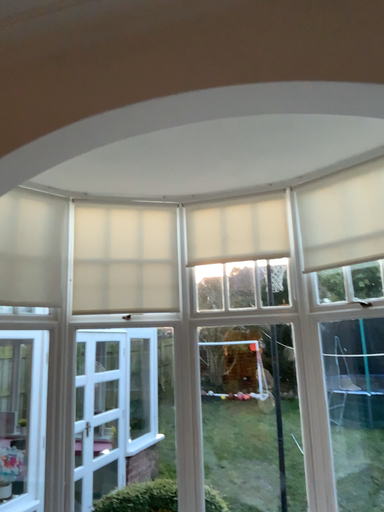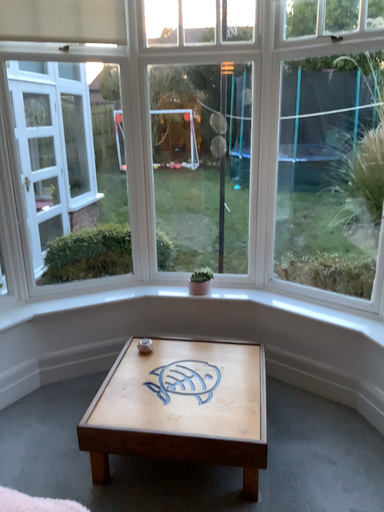
Question: How did the camera likely rotate when shooting the video?

Choices:
 (A) rotated right
 (B) rotated left

Answer: (A)